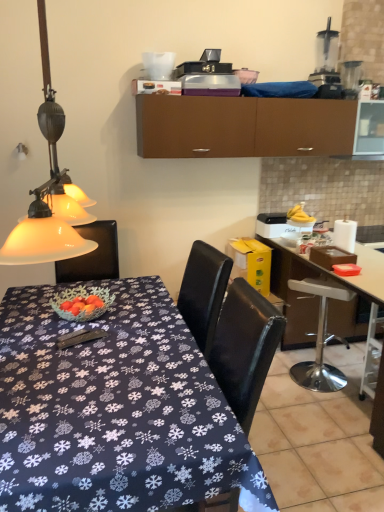
Question: From a real-world perspective, is brown matte cabinet at upper center physically above transparent plastic blender at upper right, arranged as the first appliance when viewed from the right?

Choices:
 (A) no
 (B) yes

Answer: (A)

Question: From the image's perspective, is brown matte cabinet at upper center located beneath transparent plastic blender at upper right, arranged as the first appliance when viewed from the right?

Choices:
 (A) no
 (B) yes

Answer: (B)

Question: Is brown matte cabinet at upper center not close to transparent plastic blender at upper right, the second appliance viewed from the left?

Choices:
 (A) no
 (B) yes

Answer: (A)

Question: Considering the relative sizes of brown matte cabinet at upper center and transparent plastic blender at upper right, the second appliance viewed from the left, in the image provided, is brown matte cabinet at upper center wider than transparent plastic blender at upper right, the second appliance viewed from the left,?

Choices:
 (A) no
 (B) yes

Answer: (B)

Question: Is transparent plastic blender at upper right, the second appliance viewed from the left, surrounded by brown matte cabinet at upper center?

Choices:
 (A) yes
 (B) no

Answer: (B)

Question: Does brown matte cabinet at upper center appear on the left side of transparent plastic blender at upper right, the second appliance viewed from the left?

Choices:
 (A) yes
 (B) no

Answer: (A)

Question: Considering the relative sizes of transparent plastic blender at upper right, the 2th appliance from the right, and white glossy desk at right, which is the 2th desk from left to right, in the image provided, is transparent plastic blender at upper right, the 2th appliance from the right, taller than white glossy desk at right, which is the 2th desk from left to right,?

Choices:
 (A) yes
 (B) no

Answer: (B)

Question: From a real-world perspective, is transparent plastic blender at upper right, the 2th appliance from the right, physically above white glossy desk at right, which is the 2th desk from left to right?

Choices:
 (A) no
 (B) yes

Answer: (B)

Question: From the image's perspective, would you say transparent plastic blender at upper right, the 2th appliance from the right, is positioned over white glossy desk at right, which is the 2th desk from left to right?

Choices:
 (A) no
 (B) yes

Answer: (B)

Question: Is the depth of transparent plastic blender at upper right, the 2th appliance from the right, less than that of white glossy desk at right, which is the 2th desk from left to right?

Choices:
 (A) no
 (B) yes

Answer: (A)

Question: Is white glossy desk at right, arranged as the 1th desk when viewed from the right, at the back of transparent plastic blender at upper right, arranged as the first appliance when viewed from the left?

Choices:
 (A) no
 (B) yes

Answer: (A)

Question: Would you say transparent plastic blender at upper right, the 2th appliance from the right, is outside white glossy desk at right, which is the 2th desk from left to right?

Choices:
 (A) yes
 (B) no

Answer: (A)

Question: Is white glossy desk at right, which is the 2th desk from left to right, taller than transparent plastic blender at upper right, arranged as the first appliance when viewed from the left?

Choices:
 (A) no
 (B) yes

Answer: (B)